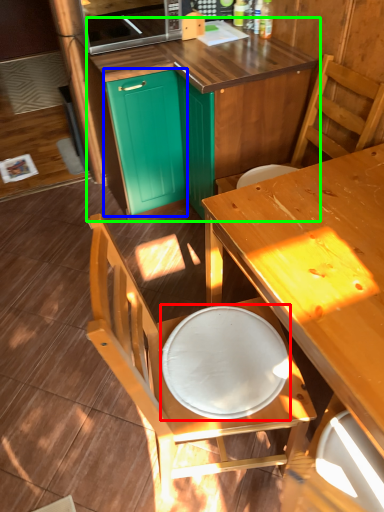
Question: Which object is positioned farthest from round table (highlighted by a red box)? Select from cabinetry (highlighted by a blue box) and cabinetry (highlighted by a green box).

Choices:
 (A) cabinetry
 (B) cabinetry

Answer: (A)